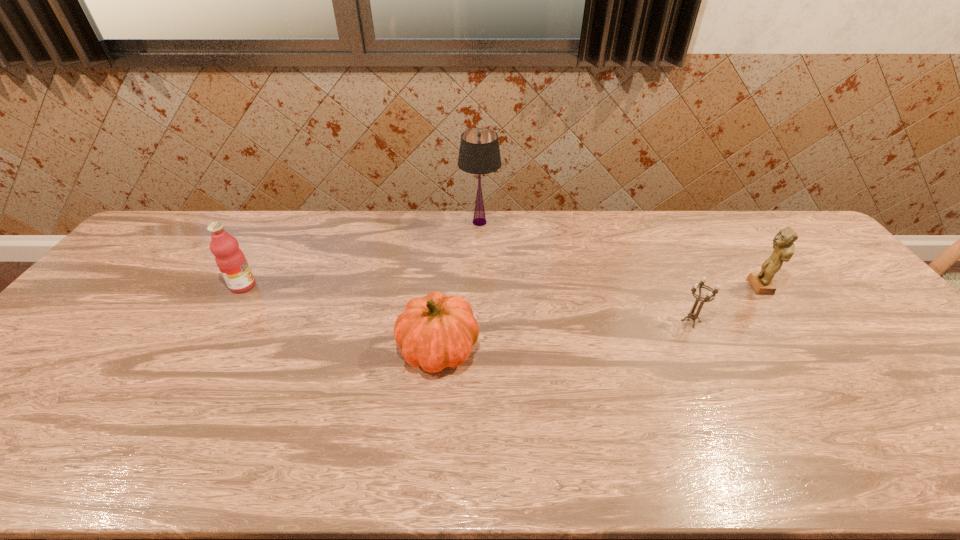
Identify the location of vacant space that satisfies the following two spatial constraints: 1. on the front-facing side of the tallest object; 2. on the front side of the fourth tallest object. This screenshot has width=960, height=540. (479, 349).

The width and height of the screenshot is (960, 540). I want to click on vacant area that satisfies the following two spatial constraints: 1. on the label of the leftmost object; 2. on the right side of the candle holder, so click(x=223, y=321).

Identify the location of free space that satisfies the following two spatial constraints: 1. on the label of the leftmost object; 2. on the back side of the pumpkin. The image size is (960, 540). (206, 349).

Locate an element on the screen. free space that satisfies the following two spatial constraints: 1. on the front-facing side of the tallest object; 2. on the left side of the shortest object is located at coordinates (479, 321).